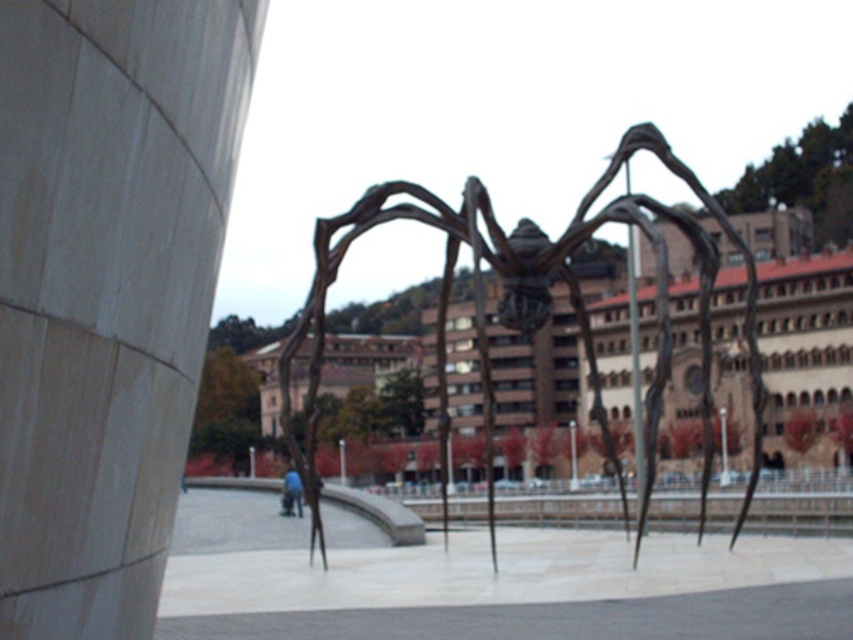
Does bronze sculpture at center lie behind blue fabric pants at center?

No, bronze sculpture at center is in front of blue fabric pants at center.

Who is more forward, (486, 209) or (291, 483)?

Point (486, 209) is in front.

This screenshot has width=853, height=640. Find the location of `bronze sculpture at center`. bronze sculpture at center is located at coordinates 514,289.

Is smooth stone pillar at left bigger than bronze sculpture at center?

Incorrect, smooth stone pillar at left is not larger than bronze sculpture at center.

Is point (38, 140) behind point (650, 422)?

No, (38, 140) is closer to viewer.

Who is more distant from viewer, (131, 390) or (283, 355)?

The point (283, 355) is more distant.

You are a GUI agent. You are given a task and a screenshot of the screen. Output one action in this format:
    pyautogui.click(x=<x>, y=<y>)
    Task: Click on the smooth stone pillar at left
    This screenshot has width=853, height=640.
    Given the screenshot: What is the action you would take?
    pyautogui.click(x=106, y=289)

Which is more to the right, smooth stone pillar at left or blue fabric pants at center?

Positioned to the right is smooth stone pillar at left.

Is point (189, 88) farther from camera compared to point (289, 481)?

No.

Does point (94, 166) come farther from viewer compared to point (289, 467)?

No, (94, 166) is closer to viewer.

Where is `smooth stone pillar at left`? The height and width of the screenshot is (640, 853). smooth stone pillar at left is located at coordinates (106, 289).